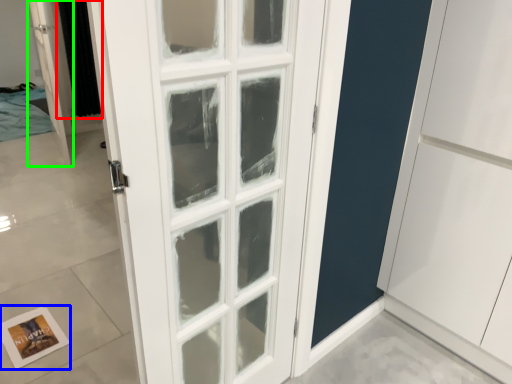
Question: Estimate the real-world distances between objects in this image. Which object is closer to curtain (highlighted by a red box), postcard (highlighted by a blue box) or door (highlighted by a green box)?

Choices:
 (A) postcard
 (B) door

Answer: (B)